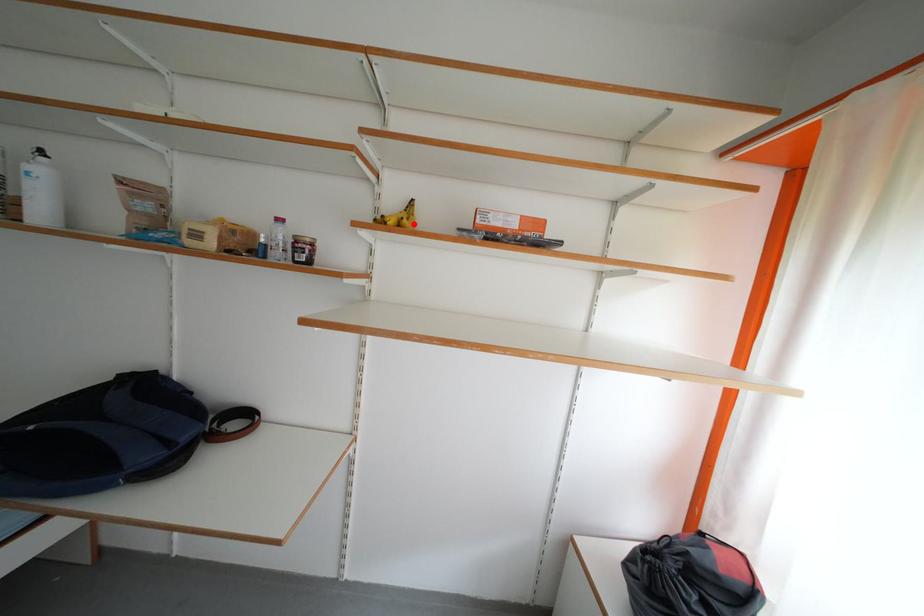
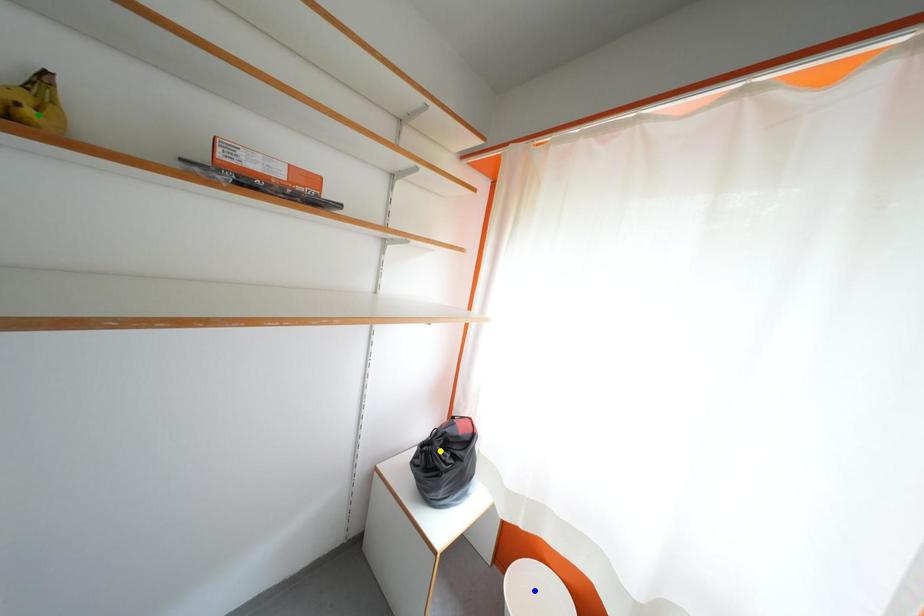
Question: I am providing you with two images of the same scene from different viewpoints. A red point is marked on the first image. You are given multiple points on the second image. In image 2, which mark is for the same physical point as the one in image 1?

Choices:
 (A) blue point
 (B) yellow point
 (C) green point

Answer: (C)